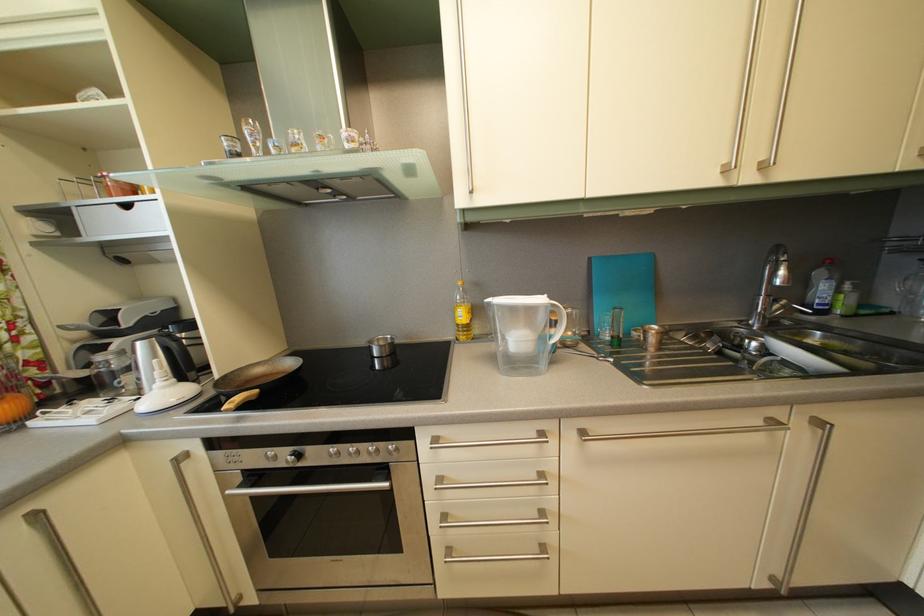
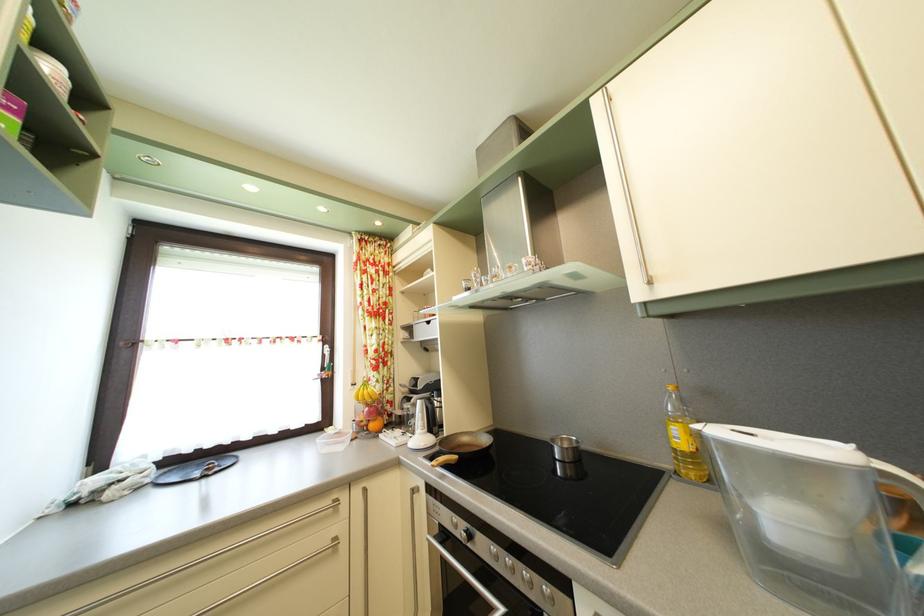
Locate, in the second image, the point that corresponds to (375,460) in the first image.

(529, 584)